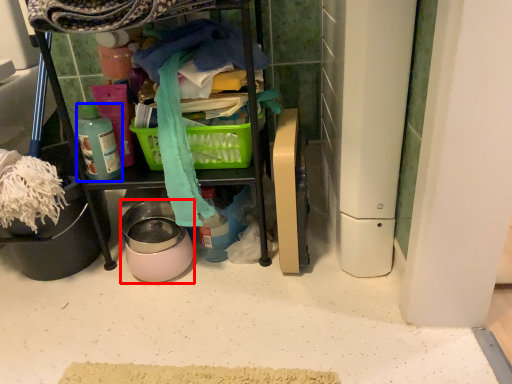
Question: Among these objects, which one is farthest to the camera, appliance (highlighted by a red box) or bottle (highlighted by a blue box)?

Choices:
 (A) appliance
 (B) bottle

Answer: (A)